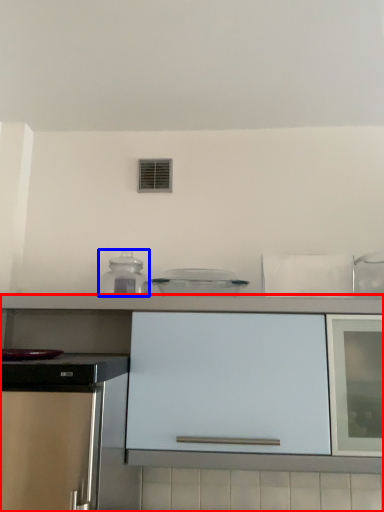
Question: Which of the following is the closest to the observer, cabinetry (highlighted by a red box) or kitchen appliance (highlighted by a blue box)?

Choices:
 (A) cabinetry
 (B) kitchen appliance

Answer: (A)